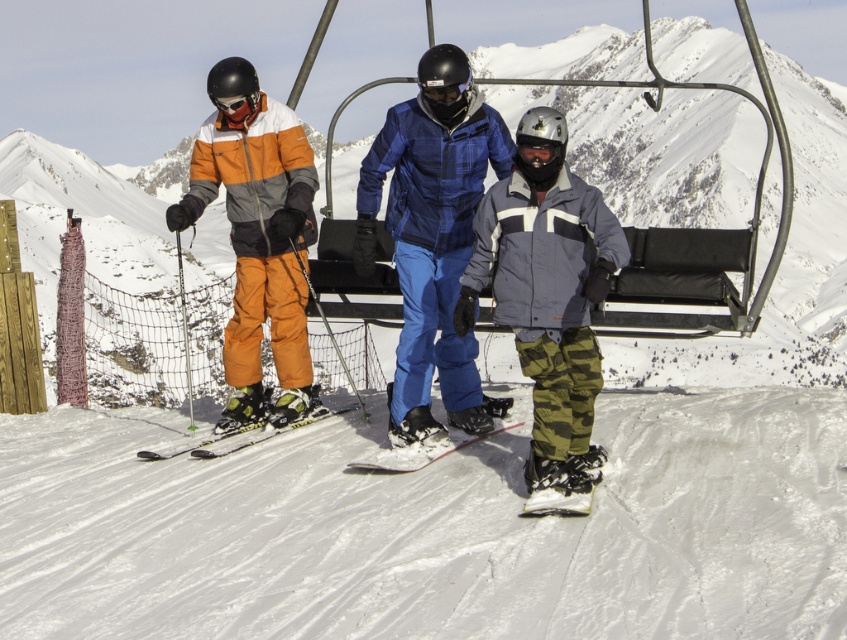
Question: Among these objects, which one is nearest to the camera?

Choices:
 (A) white snow at lower center
 (B) blue plaid ski suit at center

Answer: (A)

Question: Can you confirm if yellow-green plastic skis at lower left is bigger than white matte snowboard at center?

Choices:
 (A) no
 (B) yes

Answer: (A)

Question: Which point is farther to the camera?

Choices:
 (A) white matte snowboard at lower center
 (B) camouflage snow pants at center
 (C) blue plaid ski suit at center
 (D) white snow at lower center

Answer: (C)

Question: Which object appears farthest from the camera in this image?

Choices:
 (A) orange matte ski pants at left
 (B) camouflage snow pants at center
 (C) blue plaid ski suit at center

Answer: (A)

Question: Is white snow at lower center closer to camera compared to yellow-green plastic skis at lower left?

Choices:
 (A) yes
 (B) no

Answer: (A)

Question: Considering the relative positions of blue plaid ski suit at center and white matte snowboard at lower center in the image provided, where is blue plaid ski suit at center located with respect to white matte snowboard at lower center?

Choices:
 (A) below
 (B) above

Answer: (B)